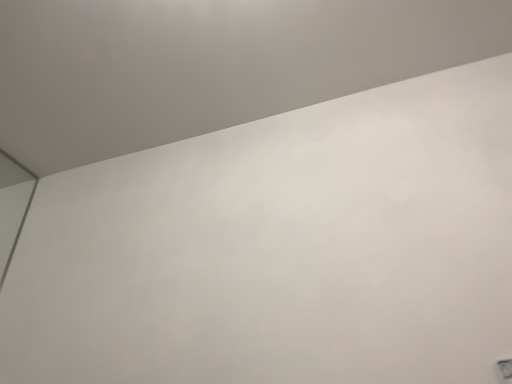
Measure the distance between point (309, 87) and camera.

The distance of point (309, 87) from camera is 39.13 inches.

Locate an element on the screen. The height and width of the screenshot is (384, 512). white matte wall at upper center is located at coordinates (209, 64).

What do you see at coordinates (209, 64) in the screenshot? The width and height of the screenshot is (512, 384). I see `white matte wall at upper center` at bounding box center [209, 64].

This screenshot has height=384, width=512. I want to click on white matte wall at upper center, so click(209, 64).